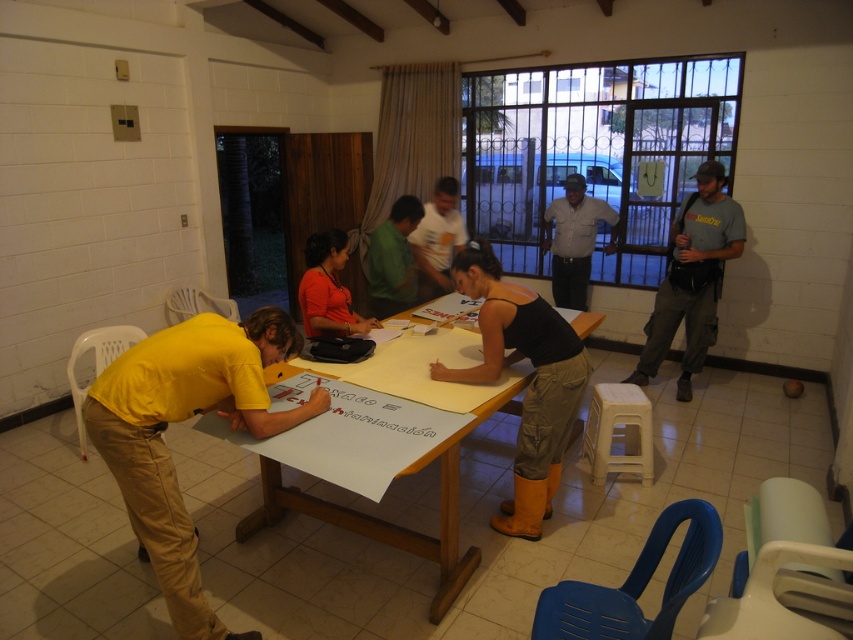
Who is shorter, yellow matte shirt at left or wooden table at center?

wooden table at center is shorter.

Is yellow matte shirt at left positioned before wooden table at center?

No.

Is point (166, 385) behind point (514, 394)?

No.

The height and width of the screenshot is (640, 853). In order to click on yellow matte shirt at left in this screenshot , I will do `click(181, 420)`.

The width and height of the screenshot is (853, 640). I want to click on gray shirt at center, so coord(573,241).

Is point (558, 244) in front of point (412, 298)?

No.

Which is in front, point (581, 294) or point (405, 269)?

Point (405, 269) is more forward.

The width and height of the screenshot is (853, 640). Find the location of `gray shirt at center`. gray shirt at center is located at coordinates (573, 241).

Does wooden table at center have a lesser height compared to gray cotton t-shirt at right?

Correct, wooden table at center is not as tall as gray cotton t-shirt at right.

Between wooden table at center and gray cotton t-shirt at right, which one has more height?

With more height is gray cotton t-shirt at right.

Find the location of a particular element. wooden table at center is located at coordinates (410, 460).